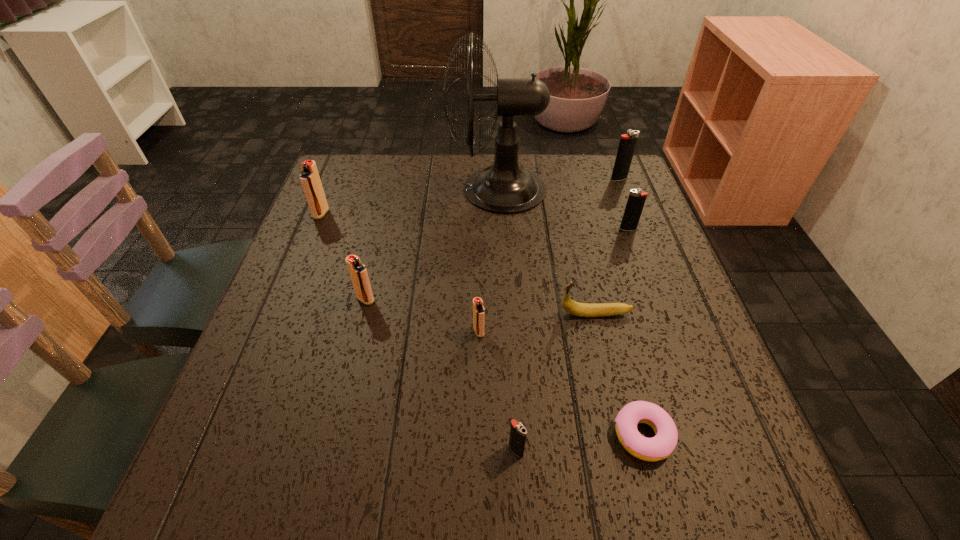
Identify the location of vacant space located 0.390m on the front of the leftmost object. (268, 346).

Locate an element on the screen. This screenshot has height=540, width=960. vacant space located 0.290m on the front of the farthest black igniter is located at coordinates (646, 250).

The image size is (960, 540). I want to click on vacant space located on the front of the second farthest black igniter, so click(653, 297).

Find the location of a particular element. The image size is (960, 540). vacant region located on the left of the second red igniter from right to left is located at coordinates (281, 299).

Find the location of a particular element. The width and height of the screenshot is (960, 540). vacant region located 0.260m at the stem of the banana is located at coordinates (435, 314).

You are a GUI agent. You are given a task and a screenshot of the screen. Output one action in this format:
    pyautogui.click(x=<x>, y=<y>)
    Task: Click on the vacant space located at the stem of the banana
    This screenshot has height=540, width=960.
    Given the screenshot: What is the action you would take?
    pyautogui.click(x=387, y=314)

The height and width of the screenshot is (540, 960). I want to click on free space located 0.290m at the stem of the banana, so click(x=420, y=314).

The height and width of the screenshot is (540, 960). What are the coordinates of `free location located on the front of the smallest red igniter` in the screenshot? It's located at (479, 373).

Identify the location of vacant space situated 0.160m on the back of the smallest black igniter. (511, 361).

The height and width of the screenshot is (540, 960). I want to click on vacant space located on the back of the pink doughnut, so pyautogui.click(x=601, y=276).